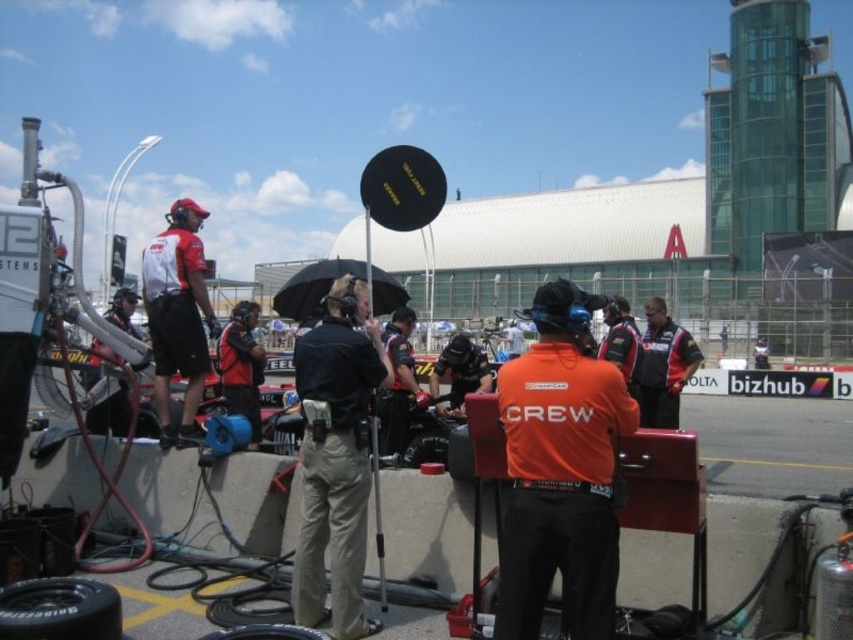
Based on the photo, is orange fabric shirt at center to the right of dark red uniform at center from the viewer's perspective?

In fact, orange fabric shirt at center is to the left of dark red uniform at center.

Which is in front, point (543, 452) or point (647, 356)?

Point (543, 452) is more forward.

Is point (514, 540) farther from viewer compared to point (695, 353)?

No, (514, 540) is in front of (695, 353).

Where is `orange fabric shirt at center`? This screenshot has width=853, height=640. orange fabric shirt at center is located at coordinates (560, 474).

What are the coordinates of `orange fabric shirt at center` in the screenshot? It's located at (560, 474).

Between point (560, 524) and point (88, 620), which one is positioned behind?

The point (88, 620) is more distant.

Who is more distant from viewer, (543, 515) or (90, 602)?

Point (90, 602)

The width and height of the screenshot is (853, 640). In order to click on orange fabric shirt at center in this screenshot , I will do `click(560, 474)`.

Who is higher up, orange fabric shirt at center or black rubber tire at center?

orange fabric shirt at center is above.

Which is in front, point (573, 600) or point (434, 442)?

Point (573, 600) is in front.

Between point (541, 522) and point (418, 435), which one is positioned behind?

The point (418, 435) is behind.

Locate an element on the screen. Image resolution: width=853 pixels, height=640 pixels. orange fabric shirt at center is located at coordinates (560, 474).